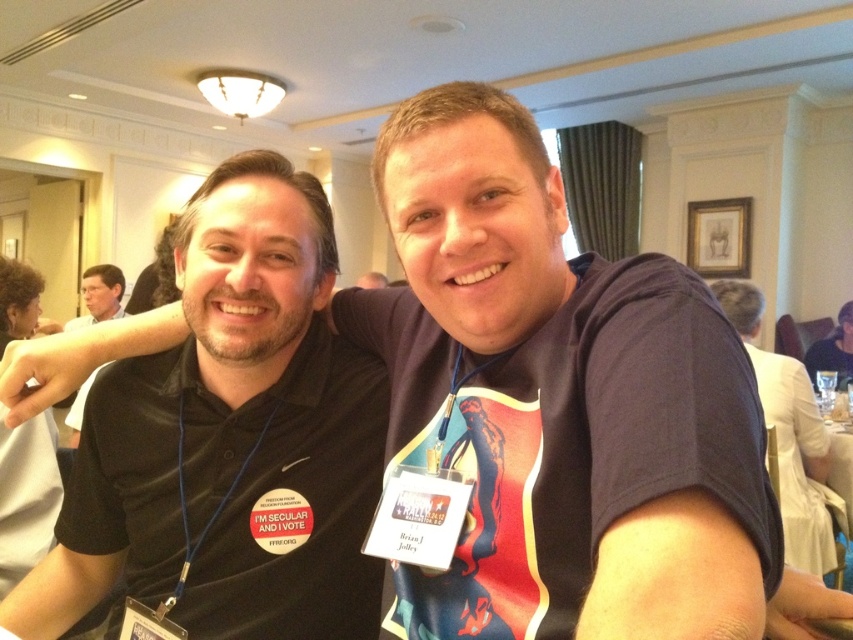
Question: Which object is the farthest from the black shirt at left?

Choices:
 (A) black matte shirt at left
 (B) black fabric shirt at upper right
 (C) dark blue t-shirt at center

Answer: (B)

Question: Which point is closer to the camera?

Choices:
 (A) dark blue t-shirt at center
 (B) black matte shirt at left
 (C) black shirt at left
 (D) black fabric shirt at upper right

Answer: (B)

Question: Is black matte shirt at left to the left of black fabric shirt at upper right from the viewer's perspective?

Choices:
 (A) yes
 (B) no

Answer: (A)

Question: Can you confirm if black matte shirt at left is smaller than black shirt at left?

Choices:
 (A) no
 (B) yes

Answer: (B)

Question: Is dark blue t-shirt at center to the left of black fabric shirt at upper right from the viewer's perspective?

Choices:
 (A) no
 (B) yes

Answer: (B)

Question: Estimate the real-world distances between objects in this image. Which object is farther from the black matte shirt at left?

Choices:
 (A) dark blue t-shirt at center
 (B) black shirt at left
 (C) black fabric shirt at upper right

Answer: (B)